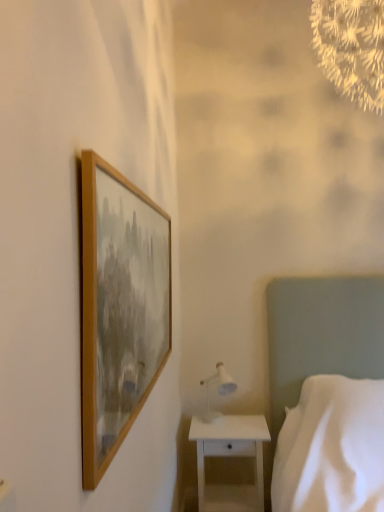
Question: Can you confirm if white fabric bed at right is smaller than white glossy table lamp at lower right?

Choices:
 (A) yes
 (B) no

Answer: (B)

Question: Does white fabric bed at right have a lesser height compared to white glossy table lamp at lower right?

Choices:
 (A) yes
 (B) no

Answer: (B)

Question: Could you tell me if white fabric bed at right is facing white glossy table lamp at lower right?

Choices:
 (A) no
 (B) yes

Answer: (A)

Question: Is white glossy table lamp at lower right located within white fabric bed at right?

Choices:
 (A) yes
 (B) no

Answer: (B)

Question: Is white fabric bed at right positioned far away from white glossy table lamp at lower right?

Choices:
 (A) no
 (B) yes

Answer: (A)

Question: Is white fabric bed at right not within white glossy table lamp at lower right?

Choices:
 (A) no
 (B) yes

Answer: (B)

Question: From the image's perspective, is white glossy nightstand at lower right located beneath wooden frame at upper left?

Choices:
 (A) no
 (B) yes

Answer: (B)

Question: Is white glossy nightstand at lower right facing towards wooden frame at upper left?

Choices:
 (A) no
 (B) yes

Answer: (A)

Question: Can you confirm if white glossy nightstand at lower right is wider than wooden frame at upper left?

Choices:
 (A) no
 (B) yes

Answer: (B)

Question: Does white glossy nightstand at lower right have a lesser width compared to wooden frame at upper left?

Choices:
 (A) yes
 (B) no

Answer: (B)

Question: Is white glossy nightstand at lower right turned away from wooden frame at upper left?

Choices:
 (A) no
 (B) yes

Answer: (A)

Question: Is white glossy nightstand at lower right taller than wooden frame at upper left?

Choices:
 (A) no
 (B) yes

Answer: (A)

Question: Is white glossy nightstand at lower right not near white glossy table lamp at lower right?

Choices:
 (A) no
 (B) yes

Answer: (A)